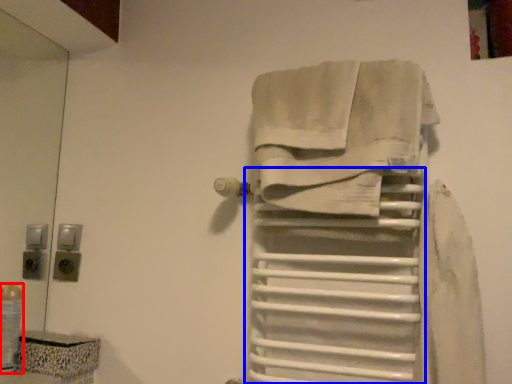
Question: Among these objects, which one is nearest to the camera, toiletry (highlighted by a red box) or shelf (highlighted by a blue box)?

Choices:
 (A) toiletry
 (B) shelf

Answer: (B)